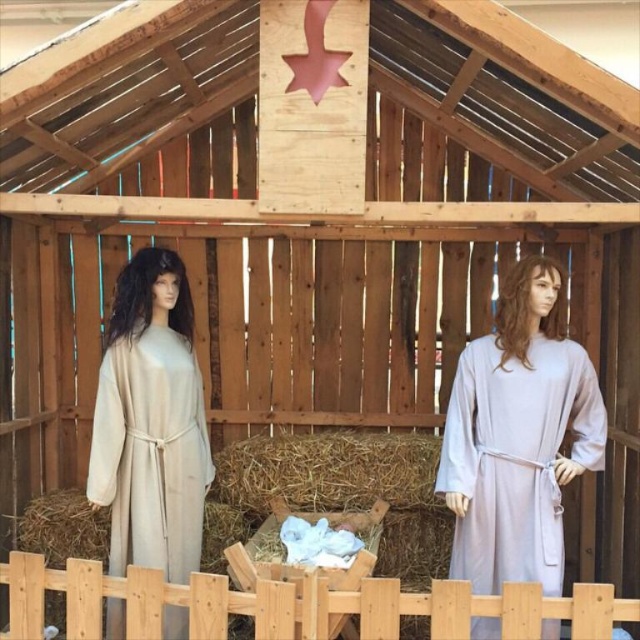
You are an observer standing in front of the nativity scene. You notice the beige fabric dress at left and the wooden fence at lower center. Which object is closer to you?

The beige fabric dress at left is closer to you because the wooden fence at lower center is behind it.

In the scene shown: You are a parent trying to place a light purple fabric dress at right on a hanger near the wooden fence at lower center. Can you hang the dress in front of the fence?

The wooden fence at lower center is behind the light purple fabric dress at right, so yes, you can hang the light purple fabric dress at right in front of the wooden fence at lower center.

You are an observer standing in front of the stable. You notice the beige fabric dress at left and the wooden fence at lower center. Which object appears narrower when viewed from your perspective?

The beige fabric dress at left appears narrower than the wooden fence at lower center because it is thinner.